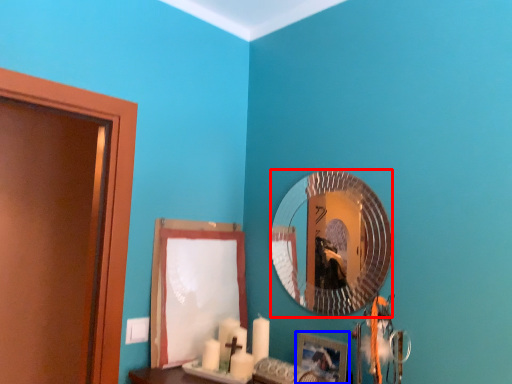
Question: Which object appears farthest to the camera in this image, mirror (highlighted by a red box) or picture frame (highlighted by a blue box)?

Choices:
 (A) mirror
 (B) picture frame

Answer: (A)